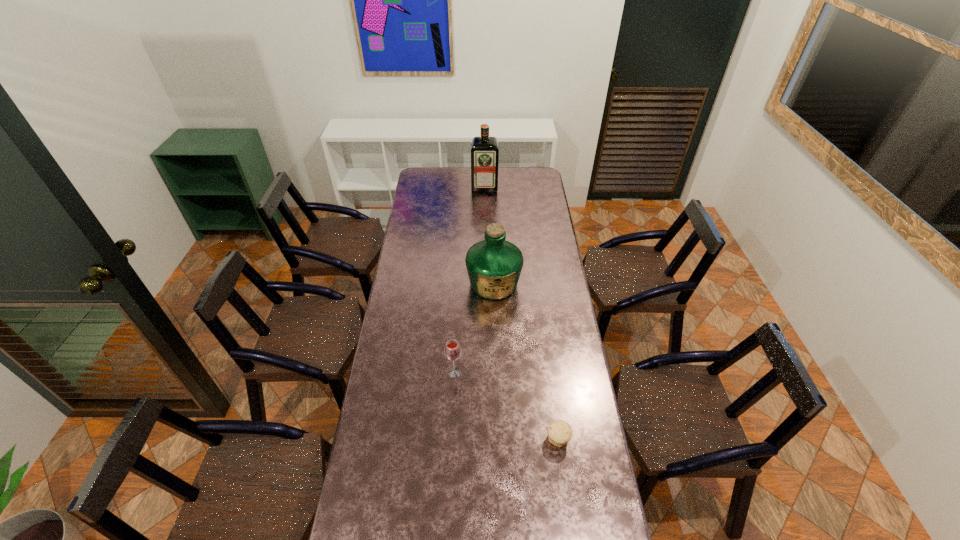
Find the location of a particular element. This screenshot has width=960, height=540. vacant area that lies between the shortest object and the third nearest object is located at coordinates (526, 361).

Locate which object is the closest to the third shortest object. Please provide its 2D coordinates. Your answer should be formatted as a tuple, i.e. [(x, y)], where the tuple contains the x and y coordinates of a point satisfying the conditions above.

[(452, 351)]

Point out which object is positioned as the third nearest to the rightmost object. Please provide its 2D coordinates. Your answer should be formatted as a tuple, i.e. [(x, y)], where the tuple contains the x and y coordinates of a point satisfying the conditions above.

[(484, 150)]

I want to click on vacant region that satisfies the following two spatial constraints: 1. on the label side of the shorter liquor; 2. on the right side of the rightmost object, so click(498, 439).

The image size is (960, 540). What are the coordinates of `blank area in the image that satisfies the following two spatial constraints: 1. on the label side of the rightmost object; 2. on the right side of the nearer liquor` in the screenshot? It's located at (498, 439).

Locate an element on the screen. This screenshot has height=540, width=960. vacant space that satisfies the following two spatial constraints: 1. on the label side of the second tallest object; 2. on the left side of the nearest object is located at coordinates (498, 439).